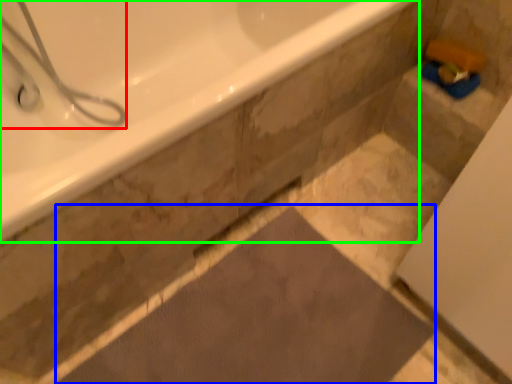
Question: Considering the real-world distances, which object is farthest from shower (highlighted by a red box)? bath mat (highlighted by a blue box) or bathtub (highlighted by a green box)?

Choices:
 (A) bath mat
 (B) bathtub

Answer: (A)